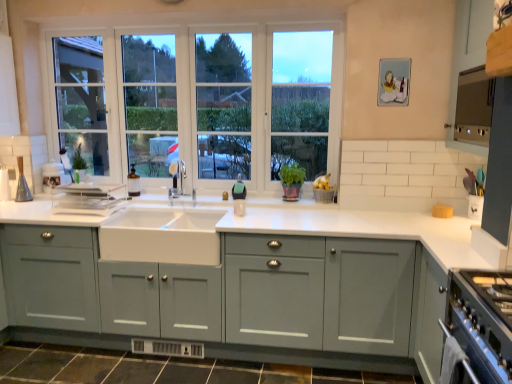
This screenshot has height=384, width=512. What do you see at coordinates (234, 298) in the screenshot? I see `matte gray cabinets at center, the 2th cabinetry from the right` at bounding box center [234, 298].

What do you see at coordinates (133, 182) in the screenshot?
I see `matte glass bottle at center` at bounding box center [133, 182].

The image size is (512, 384). What are the coordinates of `clear glass window at center` in the screenshot? It's located at (202, 101).

Where is `satin stainless steel range hood at upper right`? The width and height of the screenshot is (512, 384). satin stainless steel range hood at upper right is located at coordinates (474, 106).

Is point (454, 99) in front of point (176, 162)?

Yes, point (454, 99) is closer to viewer.

From the image's perspective, which one is positioned higher, matte gray cabinet at upper right, which ranks as the 1th cabinetry in top-to-bottom order, or satin nickel faucet at center?

From the image's view, matte gray cabinet at upper right, which ranks as the 1th cabinetry in top-to-bottom order, is above.

Is matte gray cabinet at upper right, which appears as the first cabinetry when viewed from the right, inside the boundaries of satin nickel faucet at center, or outside?

matte gray cabinet at upper right, which appears as the first cabinetry when viewed from the right, lies outside satin nickel faucet at center.

Which object is thinner, matte gray cabinet at upper right, acting as the second cabinetry starting from the bottom, or satin nickel faucet at center?

With smaller width is satin nickel faucet at center.

What's the angular difference between brown tile at lower center and matte glass bottle at center's facing directions?

The angle between the facing direction of brown tile at lower center and the facing direction of matte glass bottle at center is 2.82 degrees.

Considering the relative positions of brown tile at lower center and matte glass bottle at center in the image provided, is brown tile at lower center behind matte glass bottle at center?

No, the depth of brown tile at lower center is less than that of matte glass bottle at center.

From the image's perspective, between brown tile at lower center and matte glass bottle at center, which one is located above?

matte glass bottle at center is shown above in the image.

From a real-world perspective, is brown tile at lower center above or below matte glass bottle at center?

brown tile at lower center is below matte glass bottle at center.

What's the angular difference between clear glass window at center and matte glass bottle at center's facing directions?

The angle between the facing direction of clear glass window at center and the facing direction of matte glass bottle at center is 2.79 degrees.

Between clear glass window at center and matte glass bottle at center, which one appears on the left side from the viewer's perspective?

matte glass bottle at center is more to the left.

Is clear glass window at center turned away from matte glass bottle at center?

Yes, clear glass window at center's orientation is away from matte glass bottle at center.

Does clear glass window at center have a lesser width compared to matte glass bottle at center?

Correct, the width of clear glass window at center is less than that of matte glass bottle at center.

Is brown tile at lower center inside the boundaries of satin nickel faucet at center, or outside?

brown tile at lower center is not enclosed by satin nickel faucet at center.

Is brown tile at lower center closer to the viewer compared to satin nickel faucet at center?

Yes, brown tile at lower center is closer to the viewer.

In the scene shown: From the image's perspective, between brown tile at lower center and satin nickel faucet at center, which one is located above?

satin nickel faucet at center.

Which object is thinner, brown tile at lower center or satin nickel faucet at center?

satin nickel faucet at center.

Which is more to the right, satin nickel faucet at center or matte glass bottle at center?

satin nickel faucet at center is more to the right.

Can you confirm if satin nickel faucet at center is thinner than matte glass bottle at center?

Indeed, satin nickel faucet at center has a lesser width compared to matte glass bottle at center.

In terms of size, does satin nickel faucet at center appear bigger or smaller than matte glass bottle at center?

Clearly, satin nickel faucet at center is smaller in size than matte glass bottle at center.

In the scene shown: From a real-world perspective, is satin nickel faucet at center physically located above or below matte glass bottle at center?

satin nickel faucet at center is above matte glass bottle at center.

Which of these two, matte glass bottle at center or white ceramic sink at center, stands shorter?

Standing shorter between the two is matte glass bottle at center.

Are matte glass bottle at center and white ceramic sink at center beside each other?

No, matte glass bottle at center is not in contact with white ceramic sink at center.

Identify the location of bottle that appears on the left of white ceramic sink at center. The height and width of the screenshot is (384, 512). (133, 182).

Is matte glass bottle at center located outside white ceramic sink at center?

Yes, matte glass bottle at center is located beyond the bounds of white ceramic sink at center.

Which is behind, white ceramic sink at center or satin stainless steel range hood at upper right?

white ceramic sink at center is further from the camera.

Considering the sizes of white ceramic sink at center and satin stainless steel range hood at upper right in the image, is white ceramic sink at center wider or thinner than satin stainless steel range hood at upper right?

Clearly, white ceramic sink at center has more width compared to satin stainless steel range hood at upper right.

Is white ceramic sink at center to the right of satin stainless steel range hood at upper right from the viewer's perspective?

No.

Is point (193, 234) closer or farther from the camera than point (481, 103)?

Clearly, point (193, 234) is closer to the camera than point (481, 103).

Image resolution: width=512 pixels, height=384 pixels. There is a satin nickel faucet at center. Identify the location of cabinetry above it (from a real-world perspective). (468, 57).

You are a GUI agent. You are given a task and a screenshot of the screen. Output one action in this format:
    pyautogui.click(x=<x>, y=<y>)
    Task: Click on the tile below the matte glass bottle at center (from the image's perspective)
    This screenshot has width=512, height=384.
    Given the screenshot: What is the action you would take?
    pyautogui.click(x=161, y=368)

Based on their spatial positions, is white ceramic sink at center or clear glass window at center closer to satin nickel faucet at center?

The object closer to satin nickel faucet at center is clear glass window at center.

Considering their positions, is clear glass window at center positioned further to satin nickel faucet at center than white ceramic sink at center?

white ceramic sink at center is further to satin nickel faucet at center.

Estimate the real-world distances between objects in this image. Which object is further from clear glass window at center, white ceramic sink at center or matte gray cabinet at upper right, acting as the second cabinetry starting from the bottom?

matte gray cabinet at upper right, acting as the second cabinetry starting from the bottom, lies further to clear glass window at center than the other object.

Which object lies nearer to the anchor point brown tile at lower center, matte glass bottle at center or matte gray cabinets at center, the first cabinetry from the bottom?

matte gray cabinets at center, the first cabinetry from the bottom, lies closer to brown tile at lower center than the other object.

Looking at the image, which one is located further to brown tile at lower center, white ceramic sink at center or matte gray cabinet at upper right, acting as the second cabinetry starting from the bottom?

matte gray cabinet at upper right, acting as the second cabinetry starting from the bottom, is positioned further to the anchor brown tile at lower center.

Considering their positions, is satin stainless steel range hood at upper right positioned further to satin nickel faucet at center than clear glass window at center?

satin stainless steel range hood at upper right lies further to satin nickel faucet at center than the other object.

Estimate the real-world distances between objects in this image. Which object is closer to satin nickel faucet at center, clear glass window at center or matte gray cabinets at center, the first cabinetry from the bottom?

The object closer to satin nickel faucet at center is clear glass window at center.

Looking at the image, which one is located closer to brown tile at lower center, matte gray cabinet at upper right, the second cabinetry when ordered from left to right, or clear glass window at center?

Among the two, clear glass window at center is located nearer to brown tile at lower center.

Find the location of a particular element. This screenshot has height=384, width=512. sink between clear glass window at center and matte gray cabinets at center, acting as the first cabinetry starting from the left, in the up-down direction is located at coordinates (162, 235).

Locate an element on the screen. The width and height of the screenshot is (512, 384). bottle between clear glass window at center and matte gray cabinets at center, the 2th cabinetry in the top-to-bottom sequence, in the up-down direction is located at coordinates (133, 182).

Image resolution: width=512 pixels, height=384 pixels. I want to click on faucet that lies between clear glass window at center and matte gray cabinets at center, the first cabinetry from the bottom, from top to bottom, so click(x=177, y=178).

Where is `appliance located between matte gray cabinets at center, the 2th cabinetry in the top-to-bottom sequence, and matte gray cabinet at upper right, which ranks as the 1th cabinetry in top-to-bottom order, in the left-right direction`? The height and width of the screenshot is (384, 512). appliance located between matte gray cabinets at center, the 2th cabinetry in the top-to-bottom sequence, and matte gray cabinet at upper right, which ranks as the 1th cabinetry in top-to-bottom order, in the left-right direction is located at coordinates (474, 106).